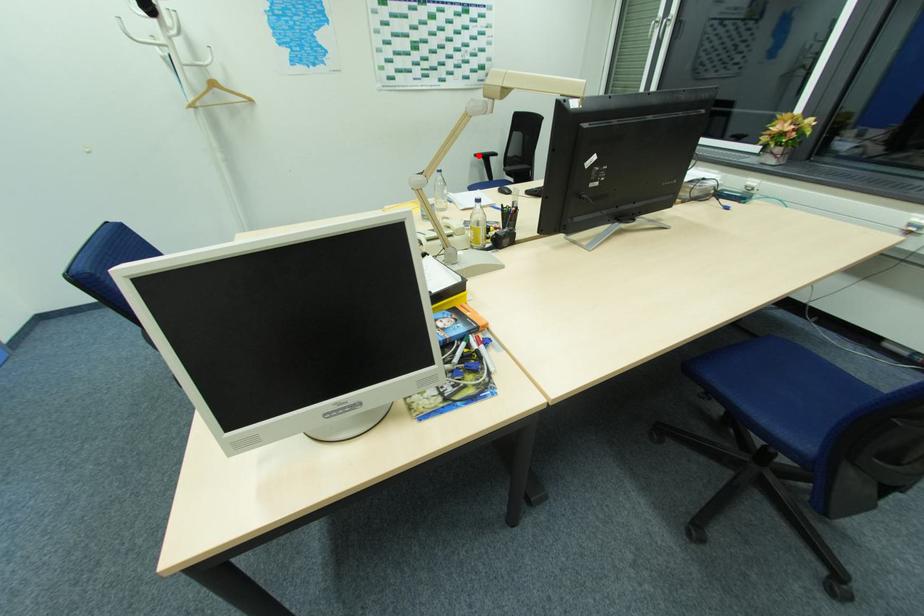
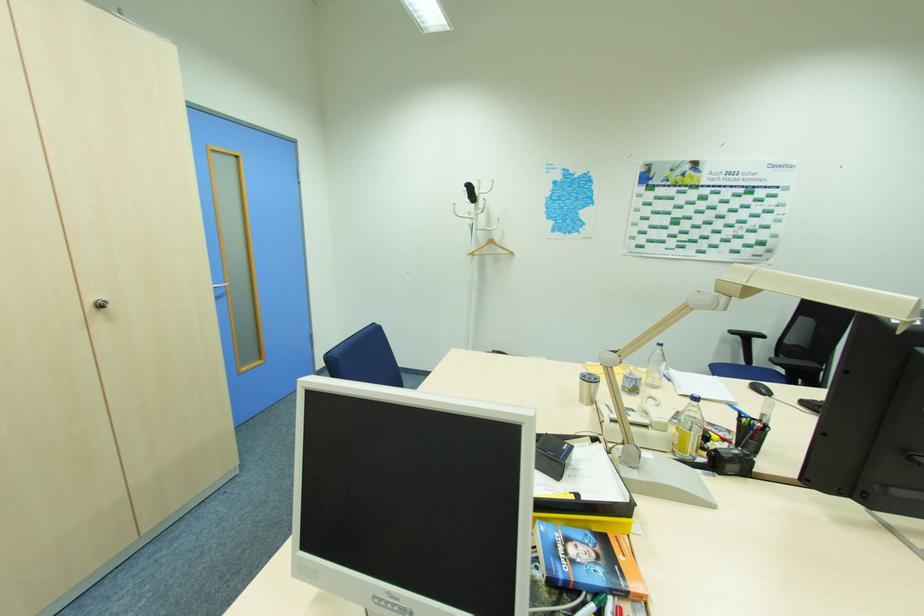
Where in the second image is the point corresponding to the highlighted location from the first image?

(734, 331)